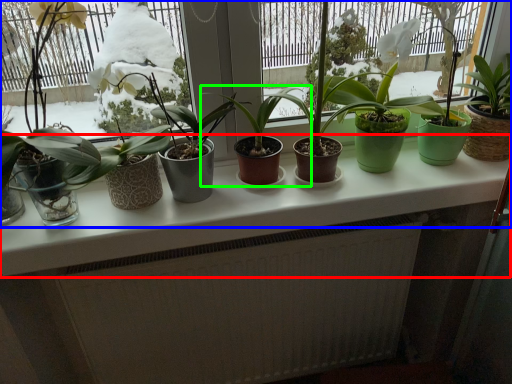
Question: Estimate the real-world distances between objects in this image. Which object is closer to counter top (highlighted by a red box), houseplant (highlighted by a blue box) or houseplant (highlighted by a green box)?

Choices:
 (A) houseplant
 (B) houseplant

Answer: (B)